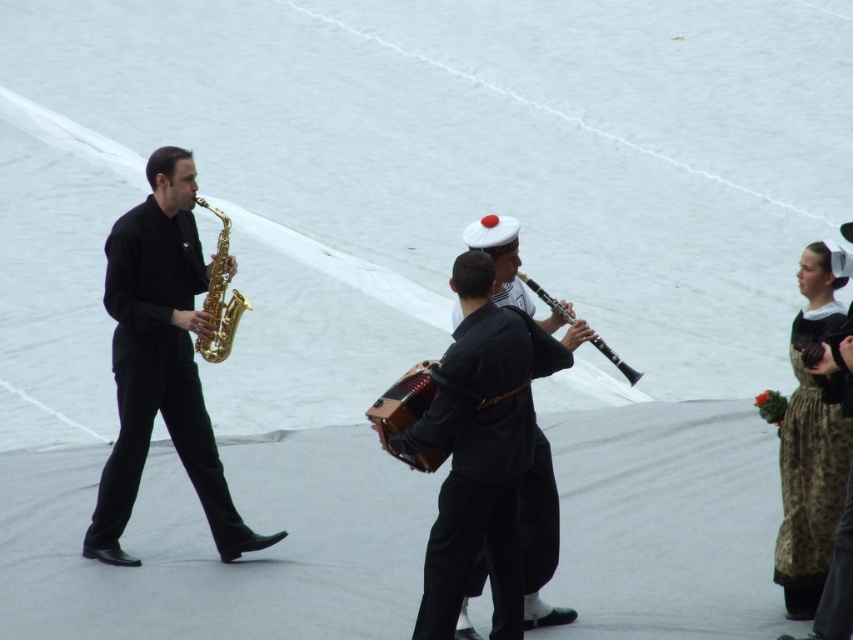
Question: Considering the relative positions of shiny gold saxophone at left and gold shiny saxophone at left in the image provided, where is shiny gold saxophone at left located with respect to gold shiny saxophone at left?

Choices:
 (A) above
 (B) below

Answer: (B)

Question: Which point appears farthest from the camera in this image?

Choices:
 (A) (390, 435)
 (B) (178, 184)

Answer: (B)

Question: Is shiny gold saxophone at left positioned in front of gold shiny saxophone at left?

Choices:
 (A) no
 (B) yes

Answer: (A)

Question: Observing the image, what is the correct spatial positioning of brown textured dress at right in reference to black plastic clarinet at center?

Choices:
 (A) left
 (B) right

Answer: (B)

Question: Which point is farther to the camera?

Choices:
 (A) (405, 440)
 (B) (549, 298)
 (C) (207, 205)
 (D) (838, 476)

Answer: (C)

Question: Which is nearer to the black fabric uniform at center?

Choices:
 (A) brown wooden accordion at center
 (B) brown textured dress at right
 (C) black plastic clarinet at center
 (D) gold shiny saxophone at left

Answer: (A)